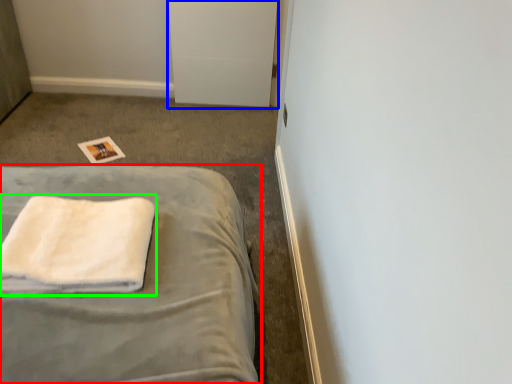
Question: Which object is positioned farthest from bed (highlighted by a red box)? Select from file cabinet (highlighted by a blue box) and towel (highlighted by a green box).

Choices:
 (A) file cabinet
 (B) towel

Answer: (A)